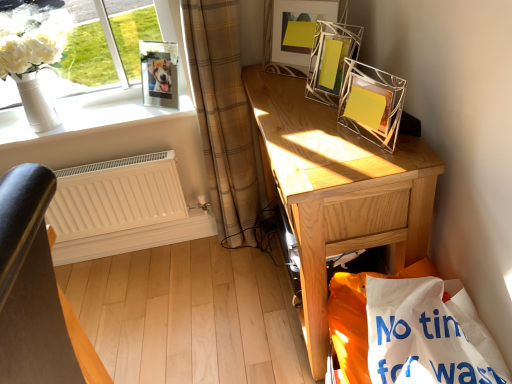
What is the approximate height of white matte radiator at lower left?

It is 16.65 inches.

What do you see at coordinates (410, 331) in the screenshot? I see `white paper shopping bag at lower right` at bounding box center [410, 331].

Describe the element at coordinates (159, 73) in the screenshot. Image resolution: width=512 pixels, height=384 pixels. I see `clear glass photo frame at upper left, the third picture frame positioned from the right` at that location.

Where is `metallic wire picture frame at upper center, the 2th picture frame from the left`? This screenshot has height=384, width=512. metallic wire picture frame at upper center, the 2th picture frame from the left is located at coordinates (289, 32).

The width and height of the screenshot is (512, 384). Identify the location of white matte radiator at lower left. (116, 196).

Does metallic wire picture frame at upper right, arranged as the 1th picture frame when viewed from the right, have a greater width compared to white paper shopping bag at lower right?

In fact, metallic wire picture frame at upper right, arranged as the 1th picture frame when viewed from the right, might be narrower than white paper shopping bag at lower right.

Is metallic wire picture frame at upper right, the 3th picture frame from the left, surrounding white paper shopping bag at lower right?

No, white paper shopping bag at lower right is located outside of metallic wire picture frame at upper right, the 3th picture frame from the left.

Is metallic wire picture frame at upper right, arranged as the 1th picture frame when viewed from the right, looking in the opposite direction of white paper shopping bag at lower right?

No, white paper shopping bag at lower right is not at the back of metallic wire picture frame at upper right, arranged as the 1th picture frame when viewed from the right.

Who is bigger, metallic wire picture frame at upper right, arranged as the 1th picture frame when viewed from the right, or white paper shopping bag at lower right?

With larger size is white paper shopping bag at lower right.

Who is smaller, light brown wooden desk at right or metallic wire picture frame at upper right, arranged as the 1th picture frame when viewed from the right?

metallic wire picture frame at upper right, arranged as the 1th picture frame when viewed from the right, is smaller.

Is there a large distance between light brown wooden desk at right and metallic wire picture frame at upper right, arranged as the 1th picture frame when viewed from the right?

light brown wooden desk at right is actually quite close to metallic wire picture frame at upper right, arranged as the 1th picture frame when viewed from the right.

From the image's perspective, between light brown wooden desk at right and metallic wire picture frame at upper right, the 3th picture frame from the left, who is located below?

From the image's view, light brown wooden desk at right is below.

Is light brown wooden desk at right closer to camera compared to metallic wire picture frame at upper right, the 3th picture frame from the left?

Yes, it is.

From a real-world perspective, who is located higher, white glossy vase at upper left or white paper shopping bag at lower right?

From a 3D spatial view, white glossy vase at upper left is above.

Is white glossy vase at upper left located outside white paper shopping bag at lower right?

Yes.

Is white glossy vase at upper left not close to white paper shopping bag at lower right?

Absolutely, white glossy vase at upper left is distant from white paper shopping bag at lower right.

Is point (99, 98) less distant than point (429, 334)?

No, (99, 98) is further to viewer.

Is light brown wooden desk at right outside of white glossy vase at upper left?

Yes, light brown wooden desk at right is not within white glossy vase at upper left.

Is light brown wooden desk at right far away from white glossy vase at upper left?

That's not correct — light brown wooden desk at right is a little close to white glossy vase at upper left.

From a real-world perspective, is white glossy vase at upper left positioned over white matte radiator at lower left based on gravity?

Yes, from a real-world perspective, white glossy vase at upper left is above white matte radiator at lower left.

From the image's perspective, is white glossy vase at upper left positioned above or below white matte radiator at lower left?

Based on their image positions, white glossy vase at upper left is located above white matte radiator at lower left.

Considering the points (77, 134) and (177, 184), which point is in front, point (77, 134) or point (177, 184)?

The point (77, 134) is more forward.

Is white glossy vase at upper left directly adjacent to white matte radiator at lower left?

white glossy vase at upper left and white matte radiator at lower left are not in contact.

Which object is closer to the camera, clear glass photo frame at upper left, which ranks as the first picture frame in left-to-right order, or light brown wooden desk at right?

Positioned in front is light brown wooden desk at right.

Is clear glass photo frame at upper left, which ranks as the first picture frame in left-to-right order, far from light brown wooden desk at right?

They are positioned close to each other.

How different are the orientations of clear glass photo frame at upper left, the third picture frame positioned from the right, and light brown wooden desk at right in degrees?

They differ by 52.9 degrees in their facing directions.

From a real-world perspective, relative to white paper shopping bag at lower right, is clear glass photo frame at upper left, the third picture frame positioned from the right, vertically above or below?

clear glass photo frame at upper left, the third picture frame positioned from the right, is situated higher than white paper shopping bag at lower right in the real world.

Is white paper shopping bag at lower right at the back of clear glass photo frame at upper left, the third picture frame positioned from the right?

That's not correct — clear glass photo frame at upper left, the third picture frame positioned from the right, is not looking away from white paper shopping bag at lower right.

Does clear glass photo frame at upper left, which ranks as the first picture frame in left-to-right order, appear on the right side of white paper shopping bag at lower right?

Incorrect, clear glass photo frame at upper left, which ranks as the first picture frame in left-to-right order, is not on the right side of white paper shopping bag at lower right.

Who is bigger, clear glass photo frame at upper left, which ranks as the first picture frame in left-to-right order, or white paper shopping bag at lower right?

white paper shopping bag at lower right.

Find the location of `the 1st picture frame above when counting from the white paper shopping bag at lower right (from the image's perspective)`. the 1st picture frame above when counting from the white paper shopping bag at lower right (from the image's perspective) is located at coordinates (331, 59).

This screenshot has width=512, height=384. I want to click on picture frame that is the 2nd one above the light brown wooden desk at right (from a real-world perspective), so click(331, 59).

Considering their positions, is metallic wire picture frame at upper right, arranged as the 1th picture frame when viewed from the right, positioned further to white glossy vase at upper left than clear glass photo frame at upper left, the third picture frame positioned from the right?

metallic wire picture frame at upper right, arranged as the 1th picture frame when viewed from the right, is positioned further to the anchor white glossy vase at upper left.

Considering their positions, is white glossy vase at upper left positioned closer to metallic wire picture frame at upper right, the 3th picture frame from the left, than white paper shopping bag at lower right?

white paper shopping bag at lower right.

Estimate the real-world distances between objects in this image. Which object is closer to metallic wire picture frame at upper center, the 2th picture frame from the left, white glossy vase at upper left or beige plaid curtain at left?

beige plaid curtain at left.

Looking at the image, which one is located further to metallic wire picture frame at upper center, the 2th picture frame from the left, light brown wooden desk at right or clear glass photo frame at upper left, the third picture frame positioned from the right?

clear glass photo frame at upper left, the third picture frame positioned from the right.

Which object lies nearer to the anchor point metallic wire picture frame at upper right, arranged as the 1th picture frame when viewed from the right, white paper shopping bag at lower right or light brown wooden desk at right?

Based on the image, light brown wooden desk at right appears to be nearer to metallic wire picture frame at upper right, arranged as the 1th picture frame when viewed from the right.

When comparing their distances from metallic wire picture frame at upper right, the 3th picture frame from the left, does light brown wooden desk at right or metallic wire picture frame at upper center, which ranks as the second picture frame in right-to-left order, seem closer?

Based on the image, metallic wire picture frame at upper center, which ranks as the second picture frame in right-to-left order, appears to be nearer to metallic wire picture frame at upper right, the 3th picture frame from the left.

When comparing their distances from white matte radiator at lower left, does light brown wooden desk at right or clear glass photo frame at upper left, the third picture frame positioned from the right, seem further?

The object further to white matte radiator at lower left is light brown wooden desk at right.

Which object lies further to the anchor point white paper shopping bag at lower right, clear glass photo frame at upper left, which ranks as the first picture frame in left-to-right order, or light brown wooden desk at right?

clear glass photo frame at upper left, which ranks as the first picture frame in left-to-right order.

Image resolution: width=512 pixels, height=384 pixels. Identify the location of desk located between white matte radiator at lower left and metallic wire picture frame at upper right, arranged as the 1th picture frame when viewed from the right, in the left-right direction. (338, 191).

Locate an element on the screen. The height and width of the screenshot is (384, 512). picture frame located between clear glass photo frame at upper left, the third picture frame positioned from the right, and metallic wire picture frame at upper right, the 3th picture frame from the left, in the left-right direction is located at coordinates (289, 32).

Find the location of `picture frame between white glossy vase at upper left and metallic wire picture frame at upper center, the 2th picture frame from the left, from left to right`. picture frame between white glossy vase at upper left and metallic wire picture frame at upper center, the 2th picture frame from the left, from left to right is located at coordinates (159, 73).

This screenshot has width=512, height=384. Find the location of `radiator situated between white glossy vase at upper left and metallic wire picture frame at upper right, arranged as the 1th picture frame when viewed from the right, from left to right`. radiator situated between white glossy vase at upper left and metallic wire picture frame at upper right, arranged as the 1th picture frame when viewed from the right, from left to right is located at coordinates (116, 196).